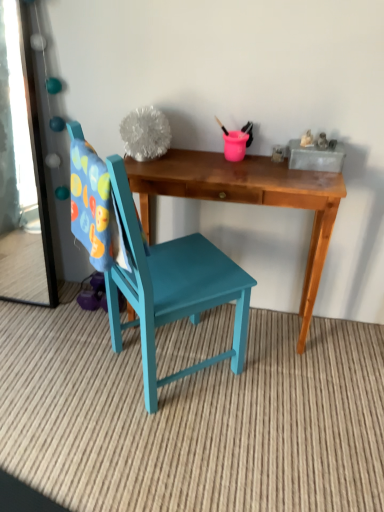
Identify the location of free space to the left of teal painted wood chair at center. Image resolution: width=384 pixels, height=512 pixels. (60, 366).